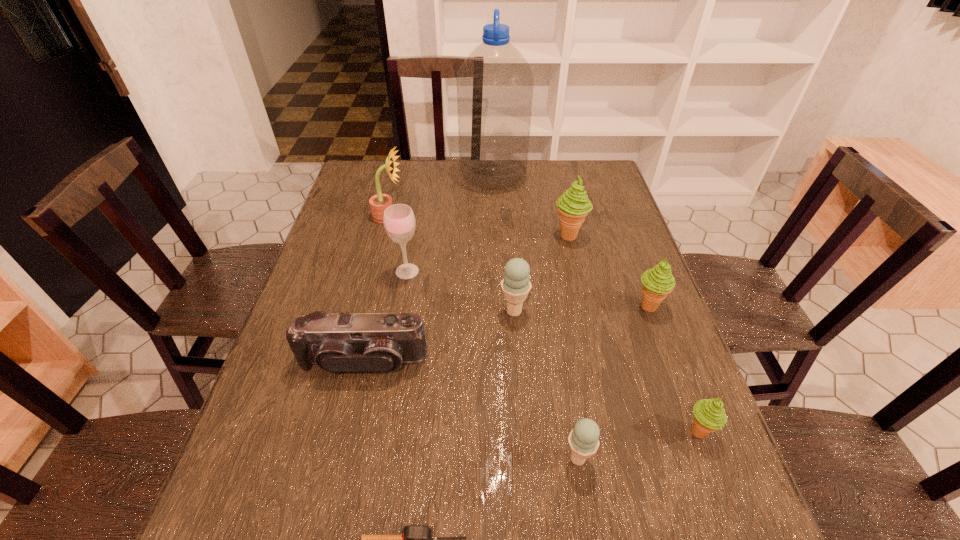
Where is `water jug`? This screenshot has width=960, height=540. water jug is located at coordinates (495, 83).

Image resolution: width=960 pixels, height=540 pixels. I want to click on the farthest object, so click(x=495, y=83).

You are a GUI agent. You are given a task and a screenshot of the screen. Output one action in this format:
    pyautogui.click(x=<x>, y=<y>)
    Task: Click on the yellow sunflower
    
    Given the screenshot: What is the action you would take?
    pyautogui.click(x=378, y=203)

You are a GUI agent. You are given a task and a screenshot of the screen. Output one action in this format:
    pyautogui.click(x=<x>, y=<y>)
    Task: Click on the leftmost green icecream
    The width and height of the screenshot is (960, 540).
    Given the screenshot: What is the action you would take?
    pyautogui.click(x=573, y=206)

Identify the location of the farthest icecream. (573, 206).

Where is `wineglass`? wineglass is located at coordinates (399, 221).

Locate an element on the screen. the farther blue ice cream is located at coordinates (516, 284).

You are a GUI agent. You are given a task and a screenshot of the screen. Output one action in this format:
    pyautogui.click(x=<x>, y=<y>)
    Task: Click on the leftmost icecream
    Image resolution: width=960 pixels, height=540 pixels.
    Given the screenshot: What is the action you would take?
    pyautogui.click(x=516, y=284)

At what (x,y) coordinates should I click in order to perform the action: click on the second biggest green icecream. Please return your answer as a coordinate pair (x, y). The width and height of the screenshot is (960, 540). Looking at the image, I should click on (658, 282).

You are a GUI agent. You are given a task and a screenshot of the screen. Output one action in this format:
    pyautogui.click(x=<x>, y=<y>)
    Task: Click on the camcorder
    The image size is (960, 540).
    Given the screenshot: What is the action you would take?
    pyautogui.click(x=371, y=342)